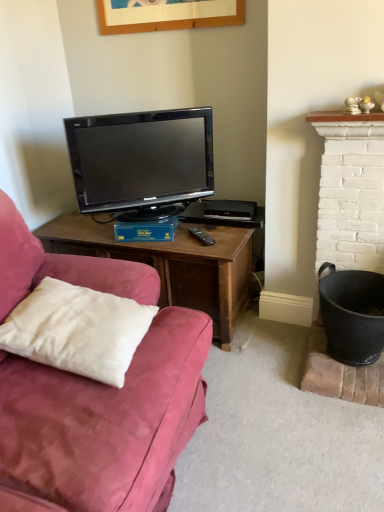
At what (x,y) coordinates should I click in order to perform the action: click on white soft pillow at lower left. Please return your answer as a coordinate pair (x, y). Looking at the image, I should click on (77, 330).

The image size is (384, 512). What do you see at coordinates (77, 330) in the screenshot?
I see `white soft pillow at lower left` at bounding box center [77, 330].

The width and height of the screenshot is (384, 512). What do you see at coordinates (141, 159) in the screenshot?
I see `black glossy television at center` at bounding box center [141, 159].

This screenshot has width=384, height=512. In order to click on black glossy television at center in this screenshot , I will do click(141, 159).

I want to click on white soft pillow at lower left, so click(77, 330).

Would you say black glossy television at center is to the left or to the right of white soft pillow at lower left in the picture?

Clearly, black glossy television at center is on the right of white soft pillow at lower left in the image.

Does black glossy television at center come behind white soft pillow at lower left?

That is True.

Between point (184, 139) and point (42, 334), which one is positioned in front?

The point (42, 334) is more forward.

From the image's perspective, is black glossy television at center located beneath white soft pillow at lower left?

Incorrect, from the image's perspective, black glossy television at center is higher than white soft pillow at lower left.

From a real-world perspective, is black glossy television at center physically above white soft pillow at lower left?

Yes, from a real-world perspective, black glossy television at center is over white soft pillow at lower left

Does black glossy television at center have a greater width compared to white soft pillow at lower left?

Incorrect, the width of black glossy television at center does not surpass that of white soft pillow at lower left.

Can you confirm if black glossy television at center is taller than white soft pillow at lower left?

Indeed, black glossy television at center has a greater height compared to white soft pillow at lower left.

Considering the sizes of black glossy television at center and white soft pillow at lower left in the image, is black glossy television at center bigger or smaller than white soft pillow at lower left?

Considering their sizes, black glossy television at center takes up more space than white soft pillow at lower left.

Is black glossy television at center inside the boundaries of white soft pillow at lower left, or outside?

black glossy television at center lies outside white soft pillow at lower left.

Is there a large distance between black glossy television at center and white soft pillow at lower left?

Actually, black glossy television at center and white soft pillow at lower left are a little close together.

Is black glossy television at center facing away from white soft pillow at lower left?

No, black glossy television at center's orientation is not away from white soft pillow at lower left.

This screenshot has height=512, width=384. What are the coordinates of `pillow on the left of black glossy television at center` in the screenshot? It's located at (77, 330).

Considering the relative positions of white soft pillow at lower left and black glossy television at center in the image provided, is white soft pillow at lower left to the left of black glossy television at center from the viewer's perspective?

Yes, white soft pillow at lower left is to the left of black glossy television at center.

Is white soft pillow at lower left positioned in front of black glossy television at center?

Yes, it is in front of black glossy television at center.

Is point (34, 334) closer to viewer compared to point (166, 121)?

Yes, point (34, 334) is closer to viewer.

From the image's perspective, is white soft pillow at lower left under black glossy television at center?

Indeed, from the image's perspective, white soft pillow at lower left is shown beneath black glossy television at center.

From a real-world perspective, is white soft pillow at lower left over black glossy television at center?

Actually, white soft pillow at lower left is physically below black glossy television at center in the real world.

Looking at their sizes, would you say white soft pillow at lower left is wider or thinner than black glossy television at center?

Considering their sizes, white soft pillow at lower left looks broader than black glossy television at center.

Between white soft pillow at lower left and black glossy television at center, which one has more height?

With more height is black glossy television at center.

Based on their sizes in the image, would you say white soft pillow at lower left is bigger or smaller than black glossy television at center?

In the image, white soft pillow at lower left appears to be smaller than black glossy television at center.

Is white soft pillow at lower left surrounding black glossy television at center?

Actually, black glossy television at center is outside white soft pillow at lower left.

Is white soft pillow at lower left not close to black glossy television at center?

No, white soft pillow at lower left is not far away from black glossy television at center.

Is white soft pillow at lower left positioned with its back to black glossy television at center?

That's not correct — white soft pillow at lower left is not looking away from black glossy television at center.

Can you tell me how much white soft pillow at lower left and black glossy television at center differ in facing direction?

The angular difference between white soft pillow at lower left and black glossy television at center is 36.7 degrees.

Find the location of `television to the right of white soft pillow at lower left`. television to the right of white soft pillow at lower left is located at coordinates (141, 159).

This screenshot has width=384, height=512. I want to click on television behind the white soft pillow at lower left, so click(x=141, y=159).

Locate an element on the screen. television positioned vertically above the white soft pillow at lower left (from a real-world perspective) is located at coordinates (141, 159).